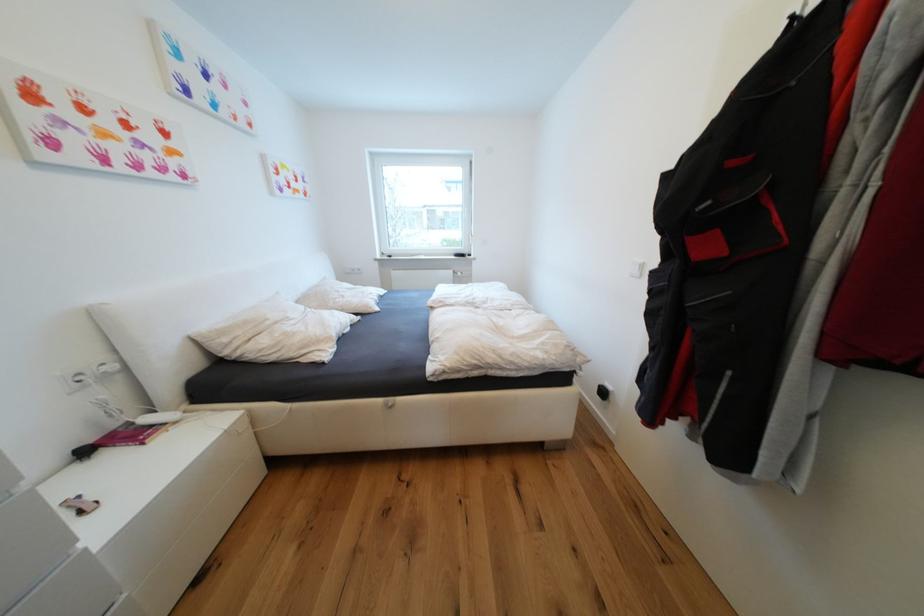
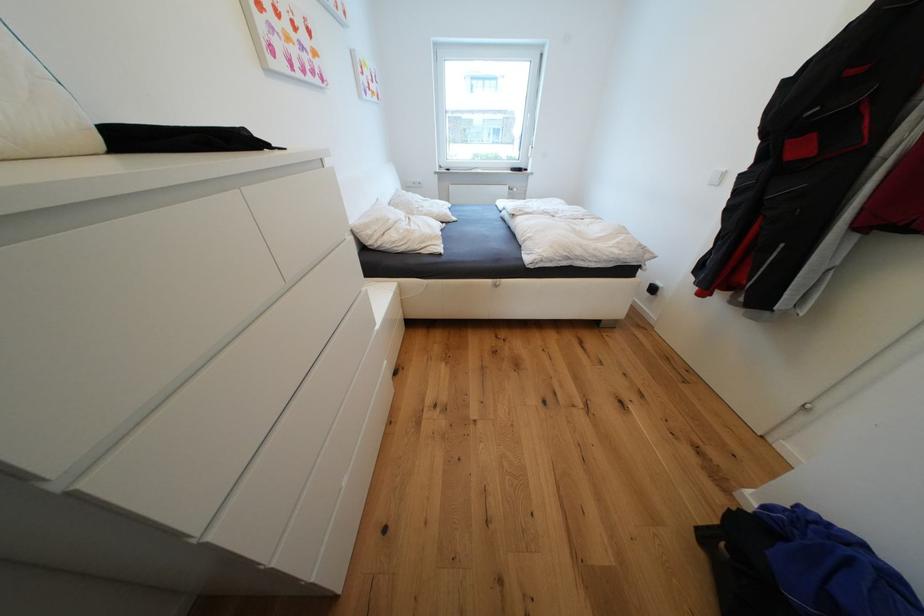
Find the pixel in the second image that matches (387,402) in the first image.

(496, 282)